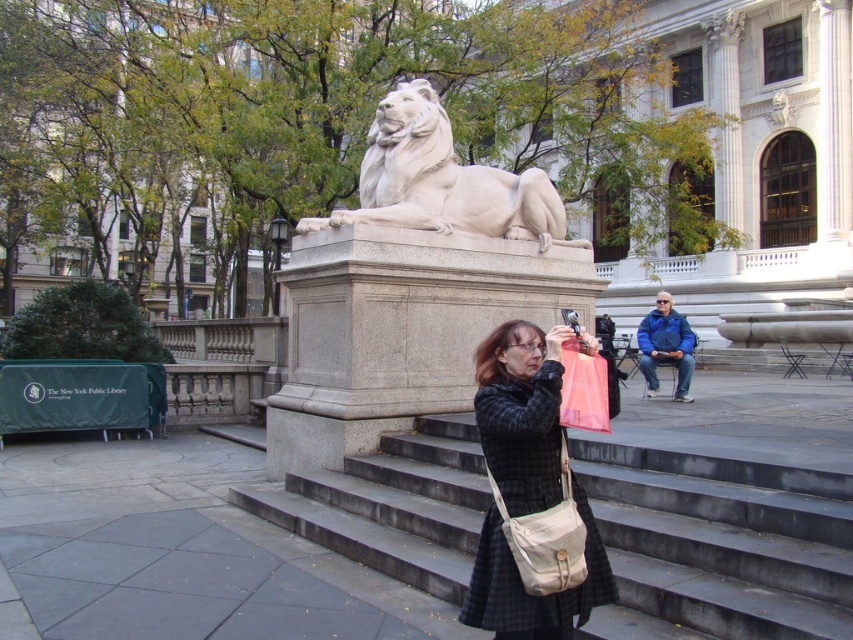
Question: Among these points, which one is farthest from the camera?

Choices:
 (A) (822, 609)
 (B) (503, 461)

Answer: (A)

Question: Which object is positioned farthest from the matte black coat at center?

Choices:
 (A) white marble lion at center
 (B) blue fleece jacket at lower right

Answer: (B)

Question: Which object appears farthest from the camera in this image?

Choices:
 (A) matte black coat at center
 (B) white marble lion at center
 (C) blue fleece jacket at lower right
 (D) smooth concrete stairs at center

Answer: (C)

Question: Does white marble lion at center come behind blue fleece jacket at lower right?

Choices:
 (A) no
 (B) yes

Answer: (A)

Question: Does smooth concrete stairs at center have a lesser width compared to matte black coat at center?

Choices:
 (A) yes
 (B) no

Answer: (B)

Question: Does smooth concrete stairs at center have a lesser width compared to blue fleece jacket at lower right?

Choices:
 (A) yes
 (B) no

Answer: (A)